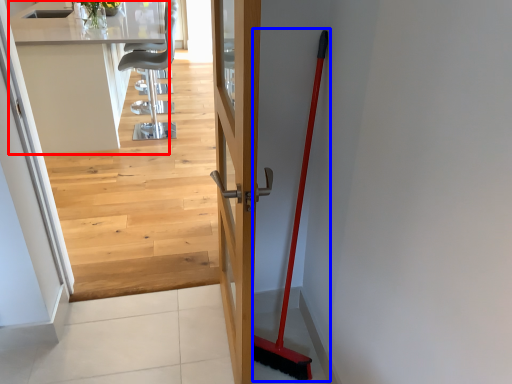
Question: Which point is further to the camera, counter top (highlighted by a red box) or shovel (highlighted by a blue box)?

Choices:
 (A) counter top
 (B) shovel

Answer: (A)